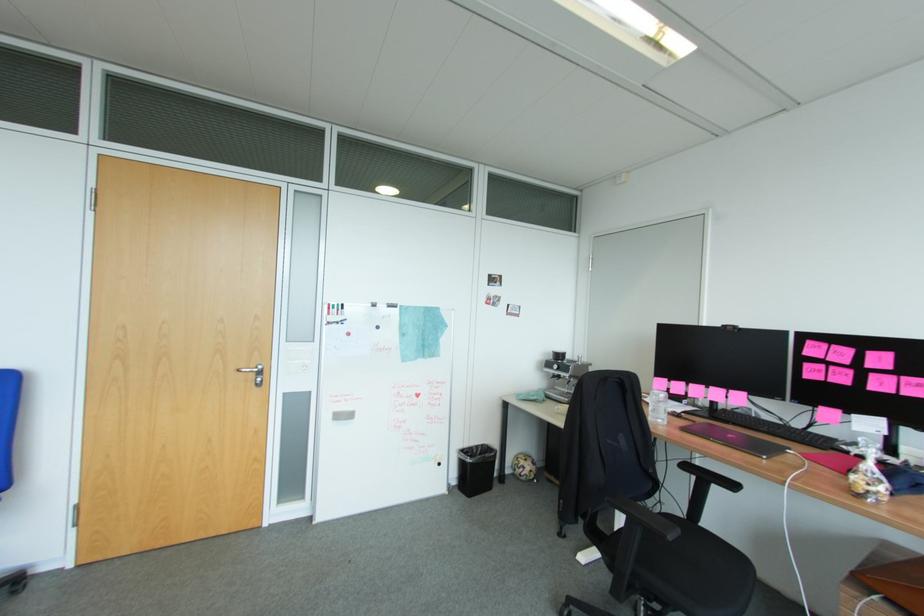
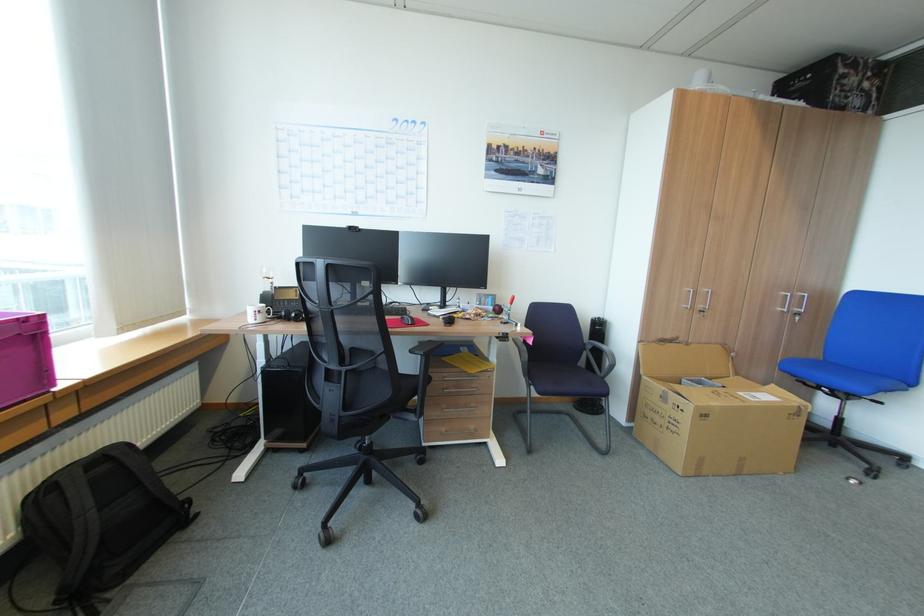
Question: The camera is either moving clockwise (left) or counter-clockwise (right) around the object. The first image is from the beginning of the video and the second image is from the end. Is the camera moving left or right when shooting the video?

Choices:
 (A) Left
 (B) Right

Answer: (B)